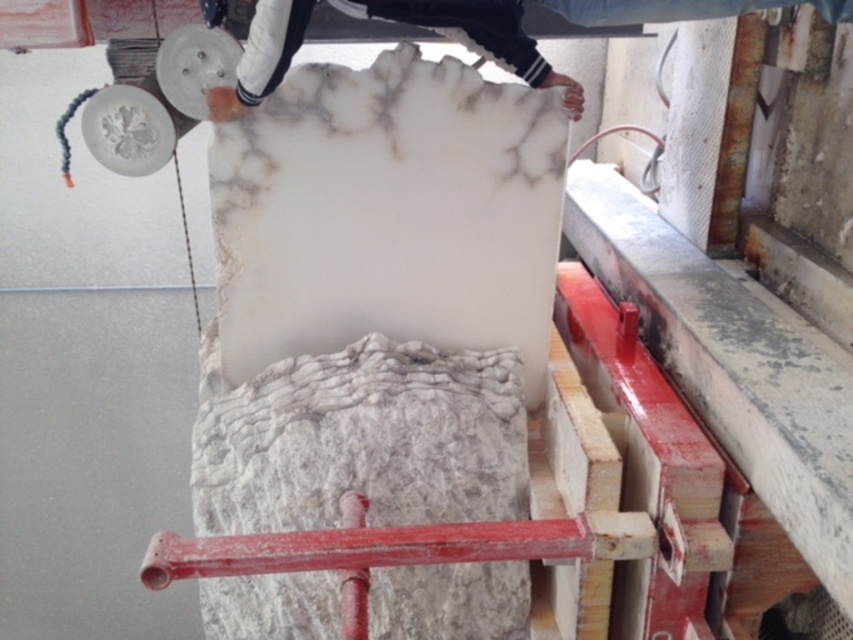
Question: Is white marble at center to the right of white marble slab at upper center from the viewer's perspective?

Choices:
 (A) yes
 (B) no

Answer: (B)

Question: Among these objects, which one is farthest from the camera?

Choices:
 (A) white marble slab at upper center
 (B) white marble at center

Answer: (B)

Question: Is white marble at center below white marble slab at upper center?

Choices:
 (A) no
 (B) yes

Answer: (B)

Question: Can you confirm if white marble at center is positioned to the right of white marble slab at upper center?

Choices:
 (A) no
 (B) yes

Answer: (A)

Question: Which of the following is the farthest from the observer?

Choices:
 (A) (228, 600)
 (B) (468, 4)

Answer: (A)